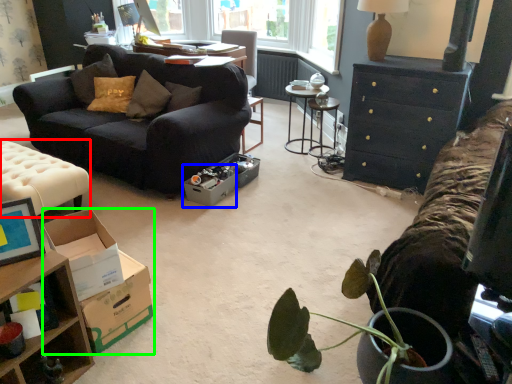
Question: Estimate the real-world distances between objects in this image. Which object is farther from table (highlighted by a red box), cardboard box (highlighted by a blue box) or cardboard box (highlighted by a green box)?

Choices:
 (A) cardboard box
 (B) cardboard box

Answer: (B)